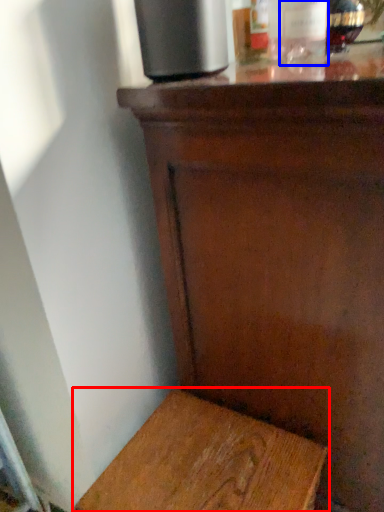
Question: Which object appears farthest to the camera in this image, furniture (highlighted by a red box) or bottle (highlighted by a blue box)?

Choices:
 (A) furniture
 (B) bottle

Answer: (B)